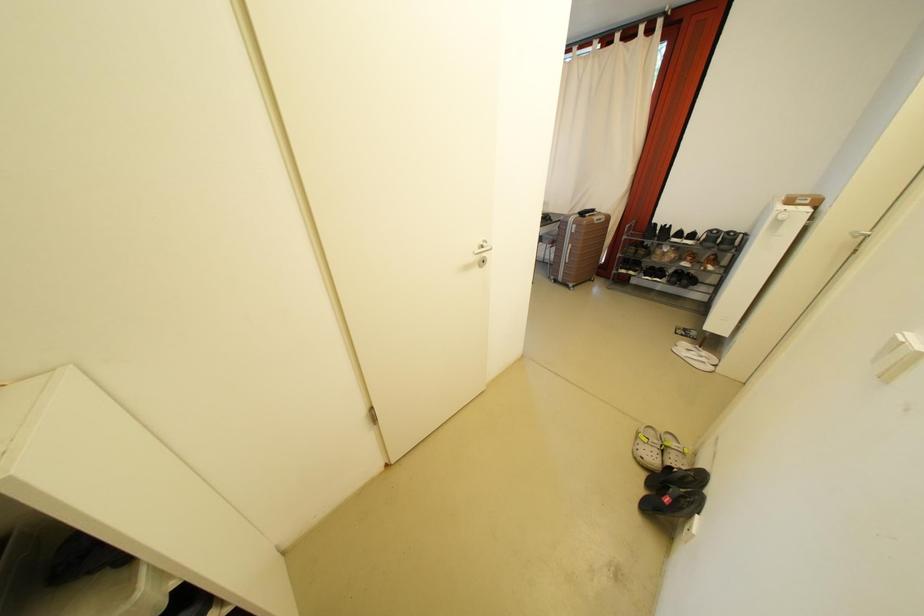
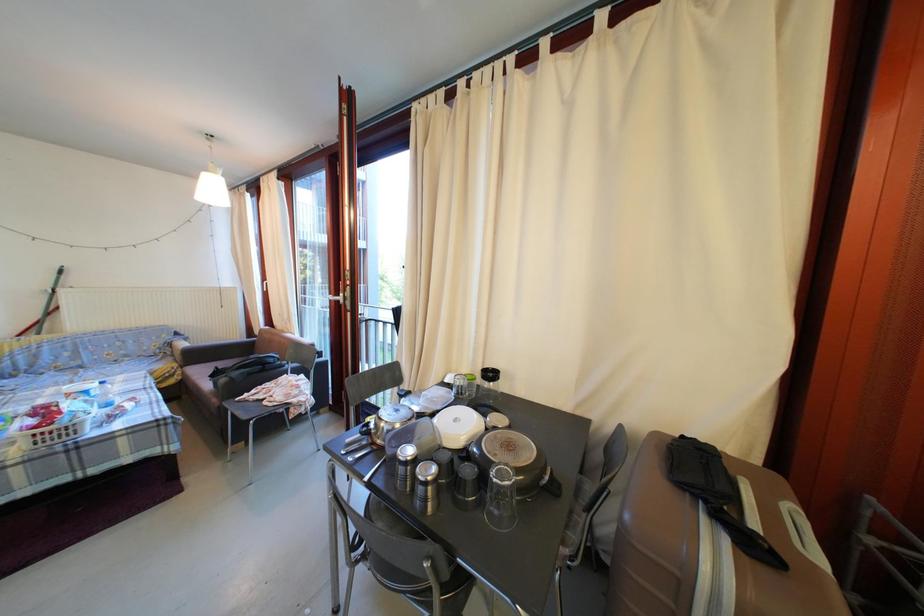
Question: What movement of the cameraman would produce the second image?

Choices:
 (A) Left
 (B) Right
 (C) Forward
 (D) Backward

Answer: (C)